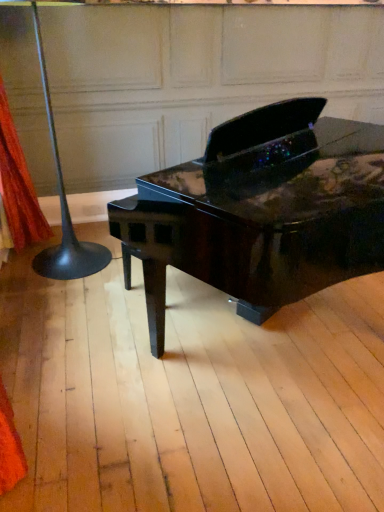
Locate an element on the screen. The width and height of the screenshot is (384, 512). vacant space in glossy black piano at center (from a real-world perspective) is located at coordinates (293, 362).